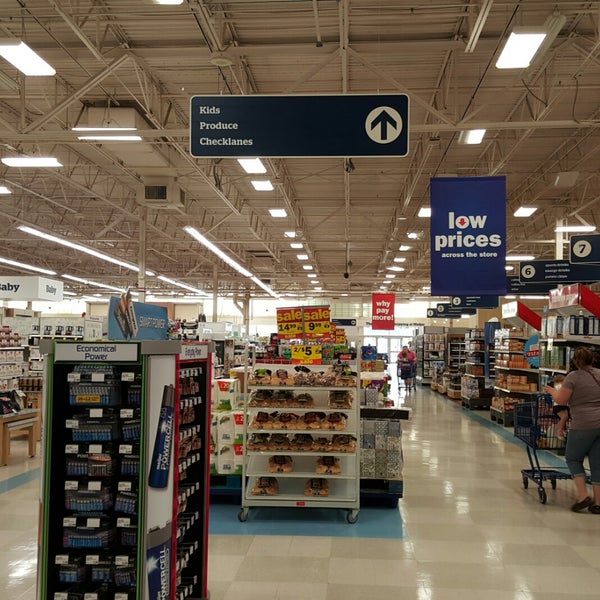
Where is `ceiling`? The image size is (600, 600). ceiling is located at coordinates (372, 176).